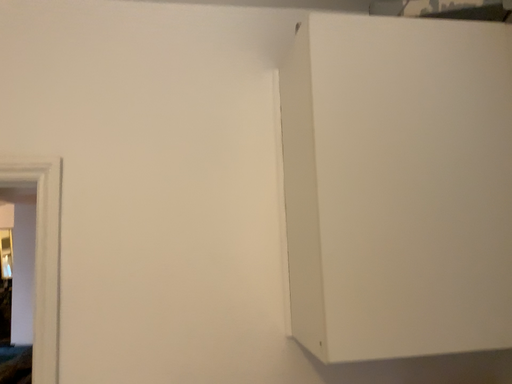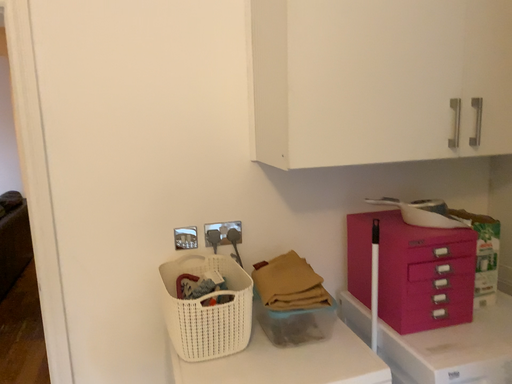
Question: Which way did the camera rotate in the video?

Choices:
 (A) rotated upward
 (B) rotated downward

Answer: (B)